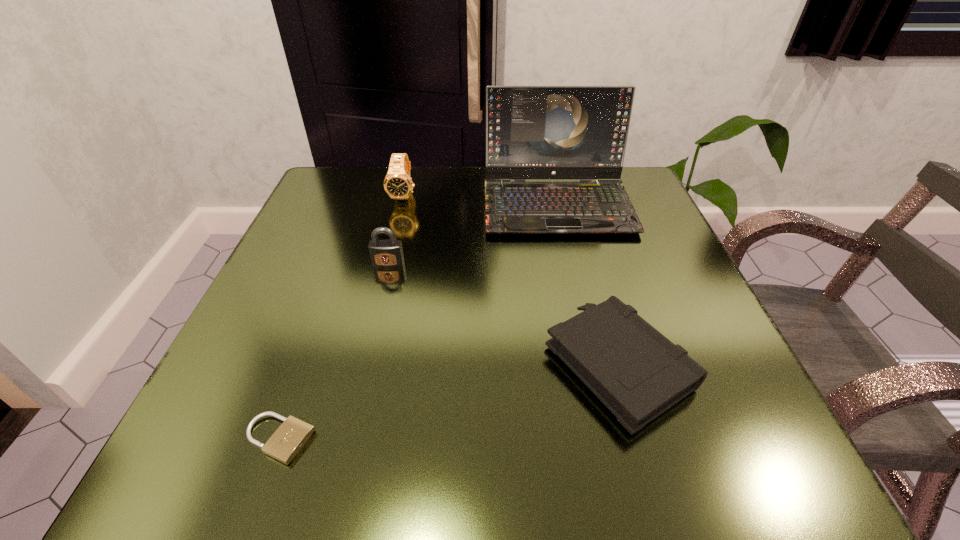
This screenshot has width=960, height=540. Find the location of `object that stands as the second closest to the tallest object`. object that stands as the second closest to the tallest object is located at coordinates (385, 253).

You are a GUI agent. You are given a task and a screenshot of the screen. Output one action in this format:
    pyautogui.click(x=<x>, y=<y>)
    Task: Click on the free space in the image that satisfies the following two spatial constraints: 1. on the face of the fourth shortest object; 2. on the right side of the fourth tallest object
    
    Given the screenshot: What is the action you would take?
    pyautogui.click(x=364, y=364)

This screenshot has width=960, height=540. In order to click on free location that satisfies the following two spatial constraints: 1. on the back side of the Bible; 2. on the right side of the leftmost object in this screenshot , I will do `click(305, 364)`.

Locate an element on the screen. vacant region that satisfies the following two spatial constraints: 1. on the screen of the fourth tallest object; 2. on the left side of the laptop computer is located at coordinates (594, 364).

In order to click on vacant space that satisfies the following two spatial constraints: 1. on the screen of the fourth tallest object; 2. on the right side of the laptop computer in this screenshot , I will do (x=594, y=364).